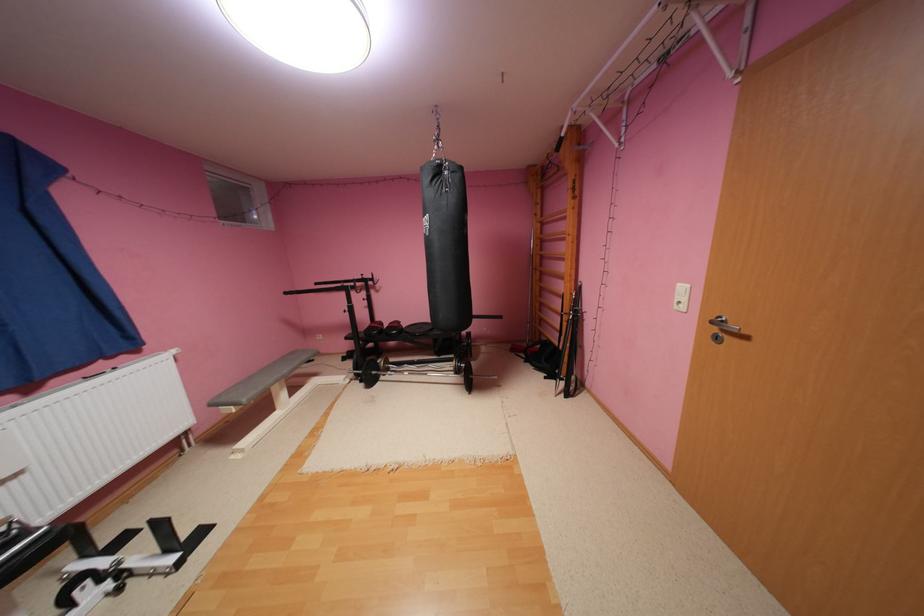
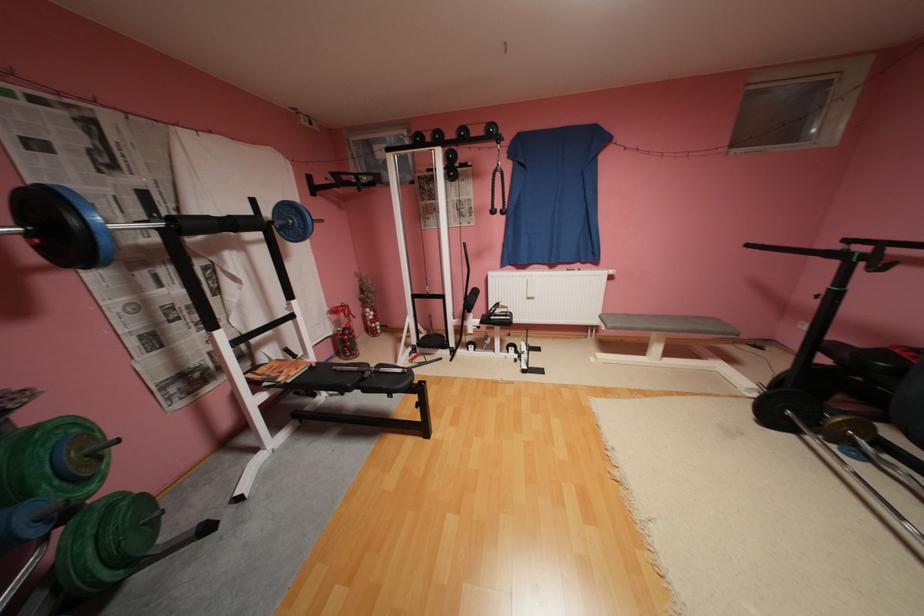
Locate, in the second image, the point that corresponds to (295,293) in the first image.

(757, 246)